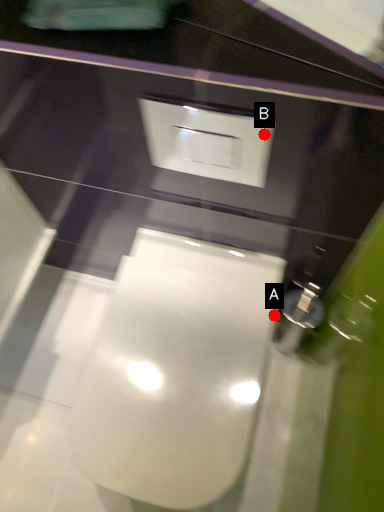
Question: Two points are circled on the image, labeled by A and B beside each circle. Which point is farther to the camera?

Choices:
 (A) A is further
 (B) B is further

Answer: (A)